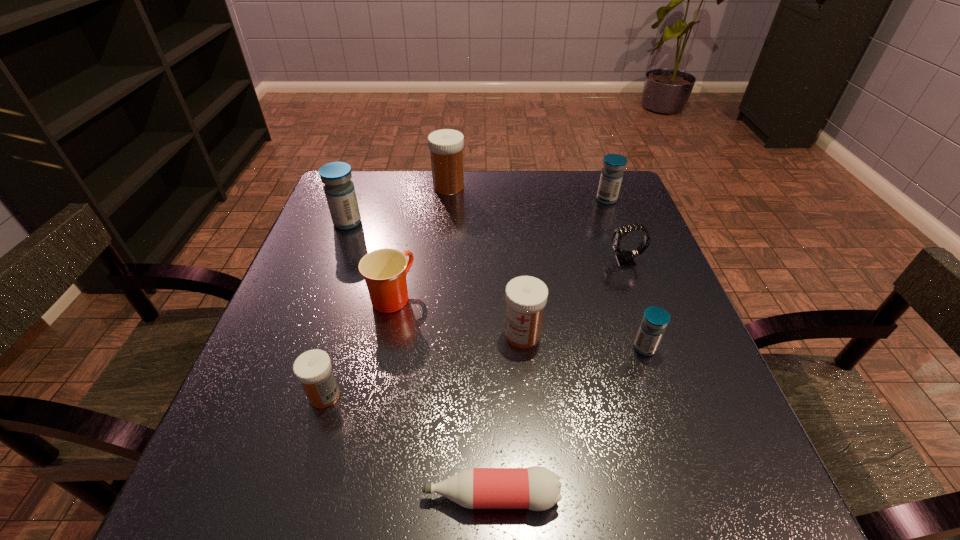
Identify the location of free area in between the second biggest white medicine and the leftmost blue medicine. The image size is (960, 540). (435, 279).

I want to click on free space that is in between the leftmost object and the smallest blue medicine, so click(496, 285).

The height and width of the screenshot is (540, 960). I want to click on vacant region between the rightmost white medicine and the pink bottle, so click(507, 415).

Where is `free area in between the biggest white medicine and the bottle`? The image size is (960, 540). free area in between the biggest white medicine and the bottle is located at coordinates (469, 342).

The height and width of the screenshot is (540, 960). In order to click on empty location between the cup and the biggest white medicine in this screenshot , I will do `click(420, 241)`.

You are a GUI agent. You are given a task and a screenshot of the screen. Output one action in this format:
    pyautogui.click(x=<x>, y=<y>)
    Task: Click on the free space between the nearest object and the second smallest white medicine
    Image resolution: width=960 pixels, height=540 pixels.
    Given the screenshot: What is the action you would take?
    pyautogui.click(x=507, y=415)

Where is `vacant point located between the watch and the bottle`? vacant point located between the watch and the bottle is located at coordinates (558, 379).

What are the coordinates of `free area in between the fifth farthest object and the shortest object` in the screenshot? It's located at (441, 396).

You are a GUI agent. You are given a task and a screenshot of the screen. Output one action in this format:
    pyautogui.click(x=<x>, y=<y>)
    Task: Click on the free spot between the third medicine from right to left and the gray watch
    
    Given the screenshot: What is the action you would take?
    pyautogui.click(x=574, y=298)

I want to click on free point between the leftmost white medicine and the third object from left to right, so click(x=358, y=346).